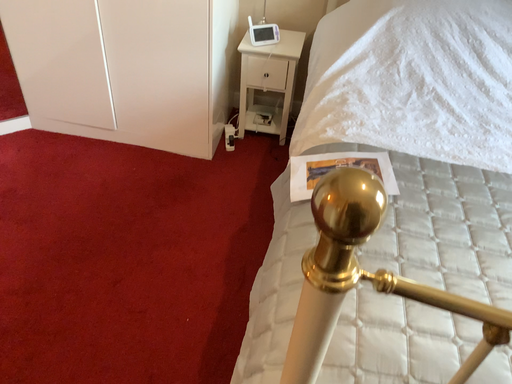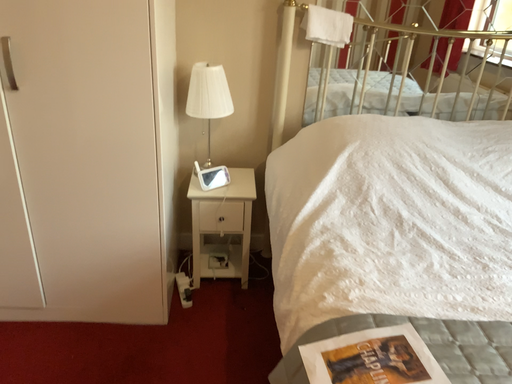
Question: Which way did the camera rotate in the video?

Choices:
 (A) rotated left
 (B) rotated right

Answer: (B)